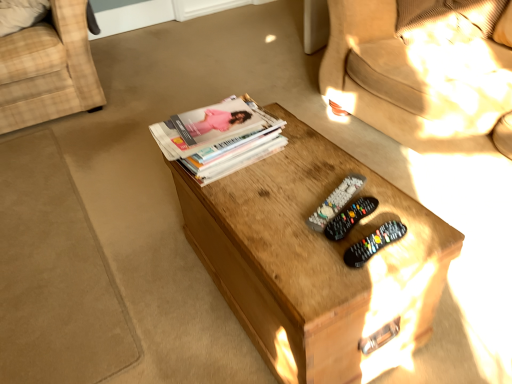
I want to click on vacant area to the left of black plastic remote at center, which is the 3th remote control from front to back, so click(274, 206).